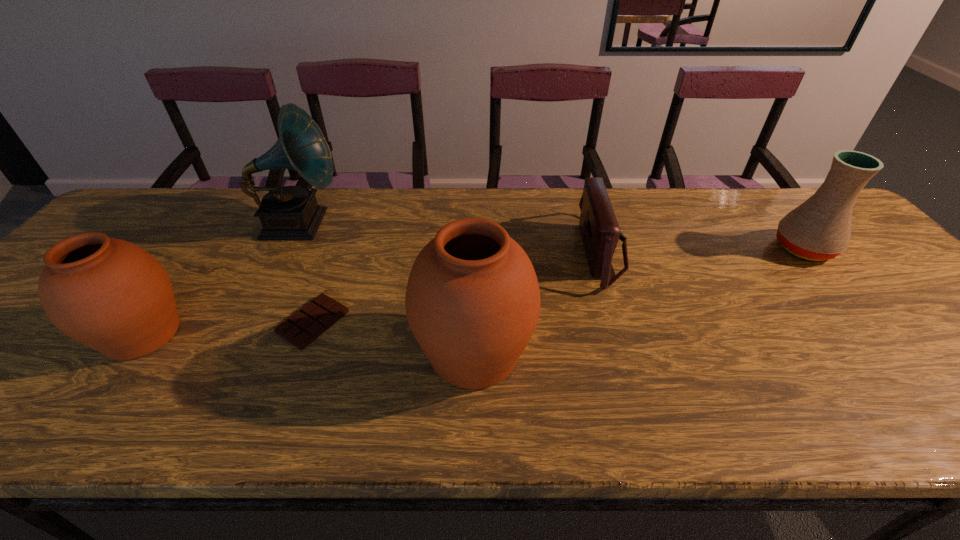
Identify the location of the shorter urn. (110, 295).

This screenshot has height=540, width=960. Identify the location of the taller urn. (472, 300).

You are a GUI agent. You are given a task and a screenshot of the screen. Output one action in this format:
    pyautogui.click(x=<x>, y=<y>)
    Task: Click on the right urn
    This screenshot has height=540, width=960.
    Given the screenshot: What is the action you would take?
    pyautogui.click(x=472, y=300)

Where is `phonograph_record`? The width and height of the screenshot is (960, 540). phonograph_record is located at coordinates (291, 212).

Locate an element on the screen. the second shortest object is located at coordinates (600, 231).

Where is `the second object from right to left`? the second object from right to left is located at coordinates (600, 231).

Locate an element on the screen. pottery is located at coordinates (819, 229).

Find the location of a particular element. This screenshot has width=960, height=540. the shortest object is located at coordinates (307, 324).

You are a GUI agent. You are given a task and a screenshot of the screen. Output one action in this format:
    pyautogui.click(x=<x>, y=<y>)
    Task: Click on the vacant point located on the left of the shorter urn
    The height and width of the screenshot is (540, 960).
    Given the screenshot: What is the action you would take?
    tap(75, 334)

You are a GUI agent. You are given a task and a screenshot of the screen. Output one action in this format:
    pyautogui.click(x=<x>, y=<y>)
    Task: Click on the vacant space located 0.320m on the left of the third object from right to left
    The image size is (960, 540).
    Given the screenshot: What is the action you would take?
    pyautogui.click(x=266, y=353)